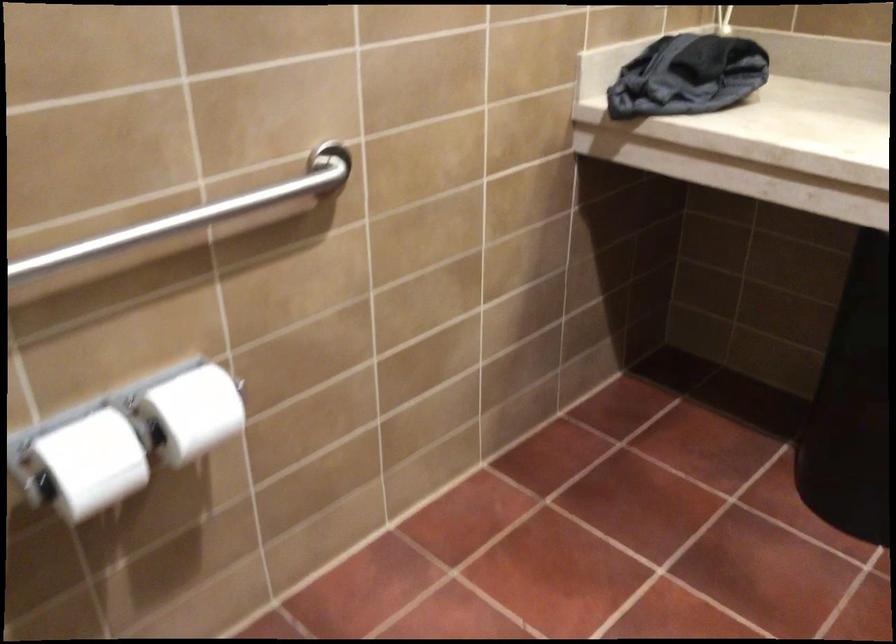
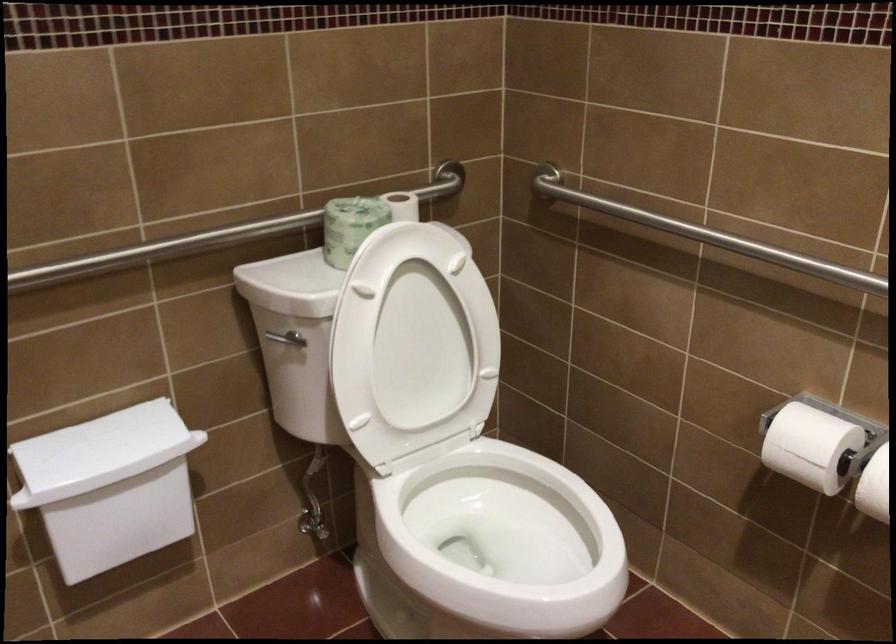
Where in the second image is the point corresponding to the point at 115,462 from the first image?

(810, 446)